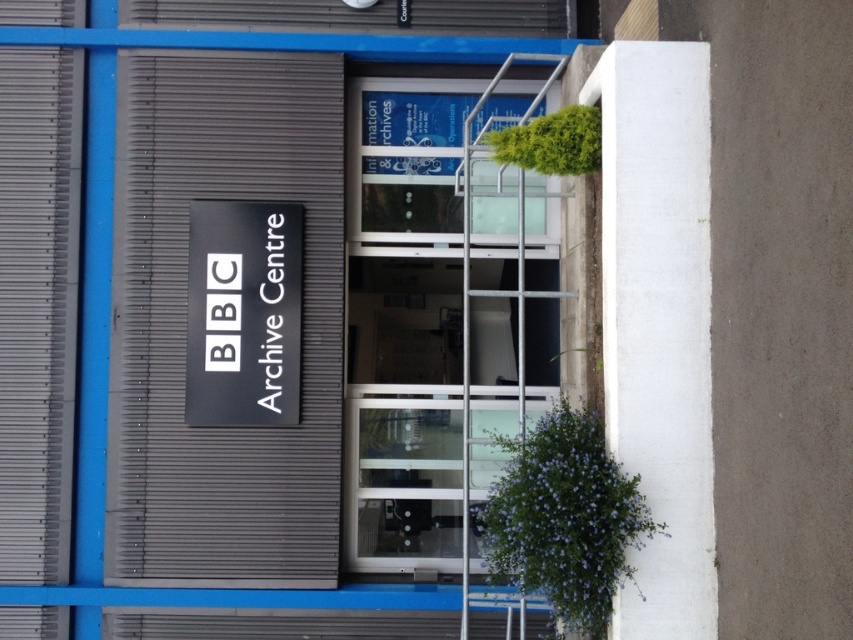
Question: Observing the image, what is the correct spatial positioning of transparent glass door at center in reference to black matte sign at center?

Choices:
 (A) above
 (B) below

Answer: (B)

Question: Which point appears farthest from the camera in this image?

Choices:
 (A) (350, 342)
 (B) (202, 355)

Answer: (A)

Question: Which point is closer to the camera taking this photo?

Choices:
 (A) (503, 349)
 (B) (192, 426)

Answer: (B)

Question: Can you confirm if transparent glass door at center is positioned to the left of black matte sign at center?

Choices:
 (A) no
 (B) yes

Answer: (A)

Question: Does transparent glass door at center appear over black matte sign at center?

Choices:
 (A) yes
 (B) no

Answer: (B)

Question: Which point is closer to the camera taking this photo?

Choices:
 (A) (236, 221)
 (B) (421, 269)

Answer: (A)